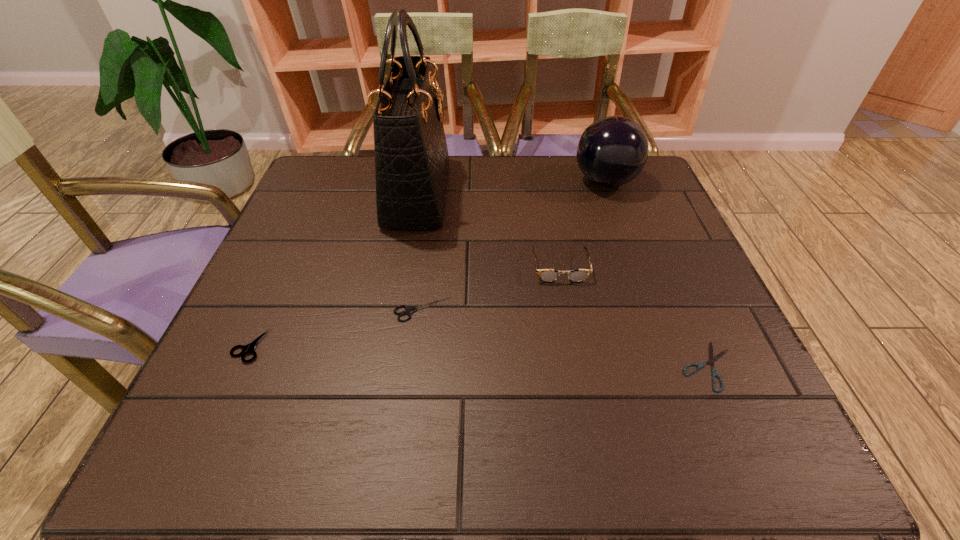
At what (x,y) coordinates should I click in order to perform the action: click on free space at the far right corner of the desktop. Please return your answer as a coordinate pair (x, y). The image size is (960, 540). Looking at the image, I should click on (656, 183).

The height and width of the screenshot is (540, 960). In the image, there is a desktop. Identify the location of vacant region at the near right corner. (713, 448).

Locate an element on the screen. This screenshot has height=540, width=960. free space between the rightmost shears and the tallest object is located at coordinates (563, 280).

Identify the location of vacant region between the handbag and the shortest object. This screenshot has height=540, width=960. (563, 280).

Where is `free area in between the tallest shears and the second shortest object`? free area in between the tallest shears and the second shortest object is located at coordinates (335, 328).

Where is `vacant area between the shortest object and the fourth object from left to right`? This screenshot has width=960, height=540. vacant area between the shortest object and the fourth object from left to right is located at coordinates (634, 317).

Where is `free space between the tallest shears and the farthest shears`? free space between the tallest shears and the farthest shears is located at coordinates (335, 328).

Find the location of a particular element. The image size is (960, 540). vacant space that is in between the handbag and the shortest object is located at coordinates (563, 280).

This screenshot has width=960, height=540. Find the location of `free spot between the shortest object and the third farthest object`. free spot between the shortest object and the third farthest object is located at coordinates (634, 317).

Identify the location of free space between the shortest shears and the fourth shortest object. (x=634, y=317).